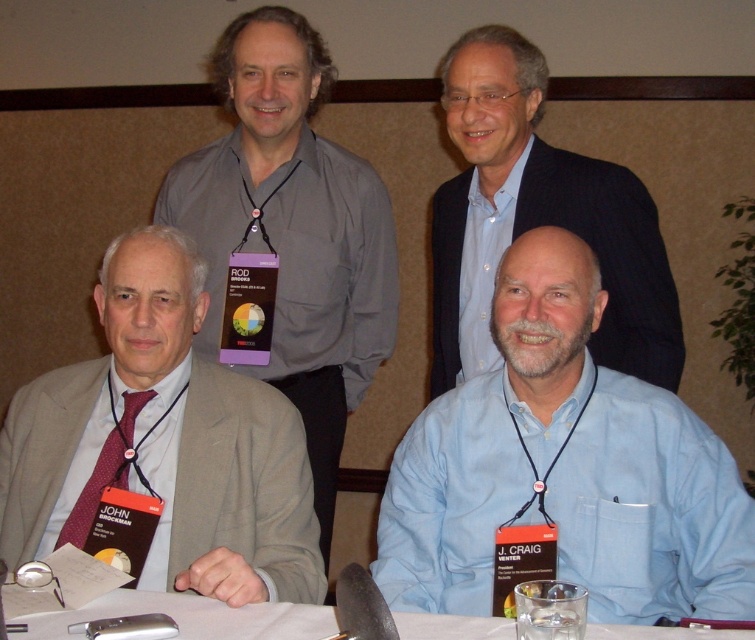
Does point (142, 356) come behind point (205, 602)?

Yes, point (142, 356) is behind point (205, 602).

Is point (213, 381) more distant than point (202, 630)?

Yes, point (213, 381) is behind point (202, 630).

Locate an element on the screen. This screenshot has height=640, width=755. light beige suit at lower left is located at coordinates (165, 444).

Does blue cotton shirt at lower right have a lesser width compared to white paper table at lower center?

Yes.

Between blue cotton shirt at lower right and white paper table at lower center, which one appears on the right side from the viewer's perspective?

blue cotton shirt at lower right is more to the right.

Does point (492, 545) come in front of point (42, 614)?

That is False.

The width and height of the screenshot is (755, 640). What are the coordinates of `blue cotton shirt at lower right` in the screenshot? It's located at (565, 468).

Which is behind, point (458, 147) or point (79, 520)?

The point (458, 147) is behind.

Is blue shirt at upper center thinner than maroon textured tie at lower left?

Incorrect, blue shirt at upper center's width is not less than maroon textured tie at lower left's.

Who is more forward, (630, 275) or (85, 486)?

Point (85, 486) is in front.

Find the location of a particular element. blue shirt at upper center is located at coordinates (547, 211).